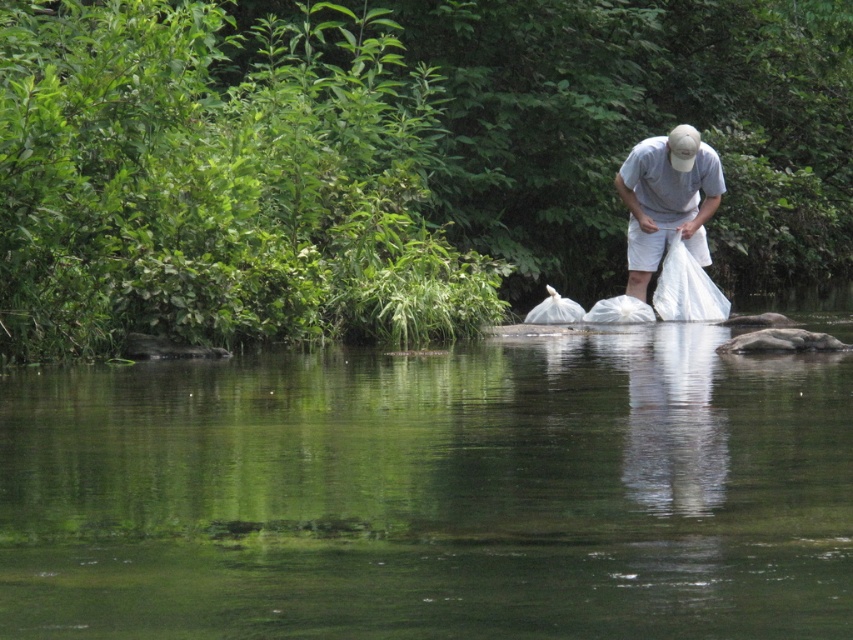
You are a hiker who wants to cross the river. You see the clear water at river center and the white fabric bag at center. Which one is shallower?

The clear water at river center has a lesser height compared to the white fabric bag at center, so the clear water at river center is shallower.

You are standing on the riverbank and want to reach the white fabric bag at center without getting your shoes wet. Can you step on the clear water at river center to get there?

The clear water at river center is in front of the white fabric bag at center, meaning the bag is on the shore or land beyond the water. Therefore, you don not need to step into the clear water at river center to reach the white fabric bag at center. You can walk around or stay on the bank.

From the picture: What is the location of the clear water at river center in the image?

The clear water at river center is located at point (433, 493).